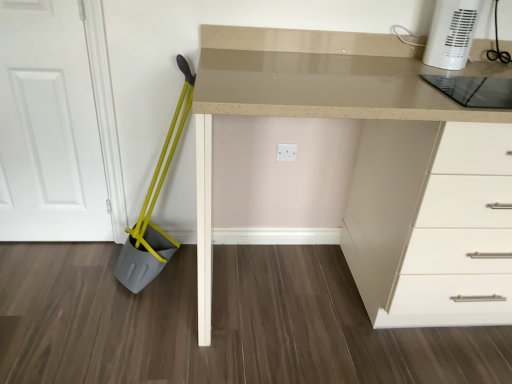
Question: Is matte beige desk at center looking in the opposite direction of white plastic heater at upper right?

Choices:
 (A) no
 (B) yes

Answer: (A)

Question: Is white plastic heater at upper right located within matte beige desk at center?

Choices:
 (A) no
 (B) yes

Answer: (A)

Question: Is matte beige desk at center to the right of white plastic heater at upper right from the viewer's perspective?

Choices:
 (A) yes
 (B) no

Answer: (B)

Question: Is matte beige desk at center in front of white plastic heater at upper right?

Choices:
 (A) yes
 (B) no

Answer: (A)

Question: Is matte beige desk at center smaller than white plastic heater at upper right?

Choices:
 (A) yes
 (B) no

Answer: (B)

Question: From the image's perspective, is matte beige desk at center located beneath white plastic heater at upper right?

Choices:
 (A) yes
 (B) no

Answer: (A)

Question: Can you confirm if white matte door at left is wider than transparent glass cutting board at upper right?

Choices:
 (A) yes
 (B) no

Answer: (B)

Question: Is white matte door at left turned away from transparent glass cutting board at upper right?

Choices:
 (A) yes
 (B) no

Answer: (B)

Question: Does white matte door at left have a smaller size compared to transparent glass cutting board at upper right?

Choices:
 (A) no
 (B) yes

Answer: (A)

Question: Considering the relative positions of white matte door at left and transparent glass cutting board at upper right in the image provided, is white matte door at left to the right of transparent glass cutting board at upper right from the viewer's perspective?

Choices:
 (A) yes
 (B) no

Answer: (B)

Question: Is white matte door at left taller than transparent glass cutting board at upper right?

Choices:
 (A) no
 (B) yes

Answer: (B)

Question: From a real-world perspective, is white matte door at left under transparent glass cutting board at upper right?

Choices:
 (A) yes
 (B) no

Answer: (A)

Question: Considering the relative positions of transparent glass cutting board at upper right and yellow plastic shovel at left in the image provided, is transparent glass cutting board at upper right to the right of yellow plastic shovel at left from the viewer's perspective?

Choices:
 (A) no
 (B) yes

Answer: (B)